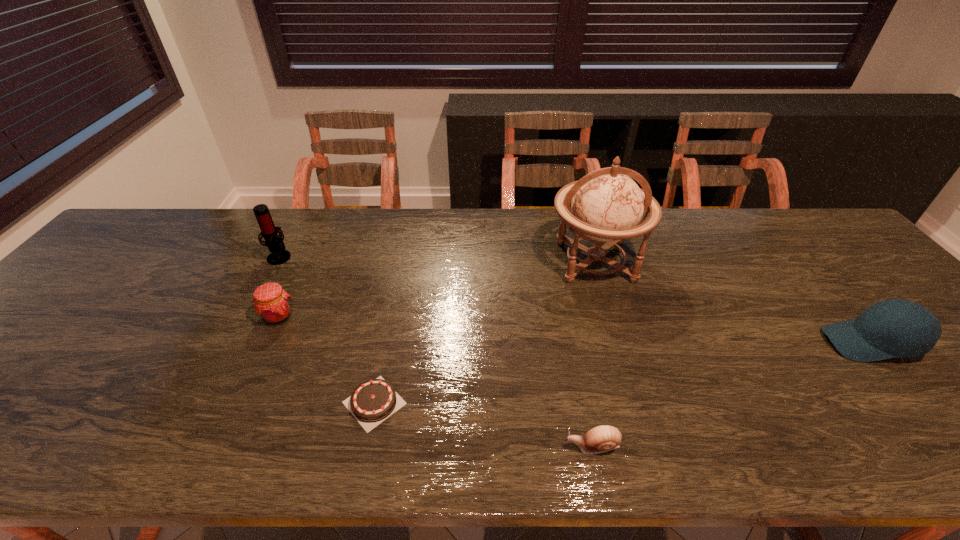
At what (x,y) coordinates should I click in order to perform the action: click on object that is the fourth closest to the fifth object from right to left. Please return your answer as a coordinate pair (x, y). The width and height of the screenshot is (960, 540). Looking at the image, I should click on (603, 438).

Select which object is the fifth closest to the shortest object. Please provide its 2D coordinates. Your answer should be formatted as a tuple, i.e. [(x, y)], where the tuple contains the x and y coordinates of a point satisfying the conditions above.

[(892, 328)]

Where is `blank area in the image that satisfies the following two spatial constraints: 1. at the front of the tallest object showing Africa; 2. on the front-facing side of the fifth tallest object`? blank area in the image that satisfies the following two spatial constraints: 1. at the front of the tallest object showing Africa; 2. on the front-facing side of the fifth tallest object is located at coordinates (651, 447).

Find the location of a particular element. This screenshot has width=960, height=540. blank space that satisfies the following two spatial constraints: 1. at the front of the globe showing Africa; 2. on the front-facing side of the second shortest object is located at coordinates (651, 447).